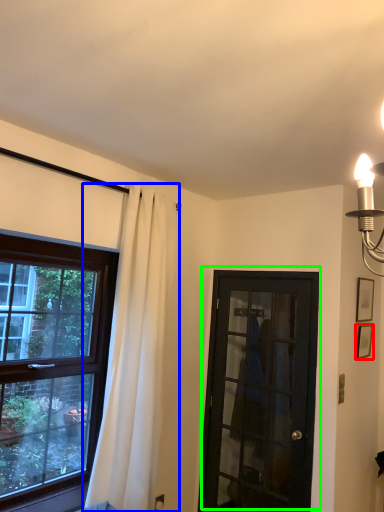
Question: Considering the real-world distances, which object is closest to picture frame (highlighted by a red box)? curtain (highlighted by a blue box) or door (highlighted by a green box).

Choices:
 (A) curtain
 (B) door

Answer: (B)